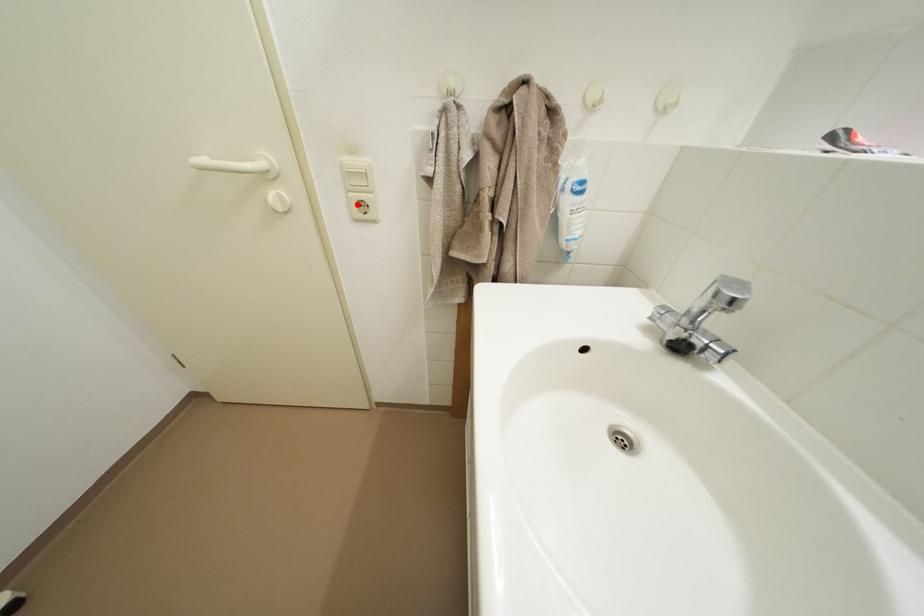
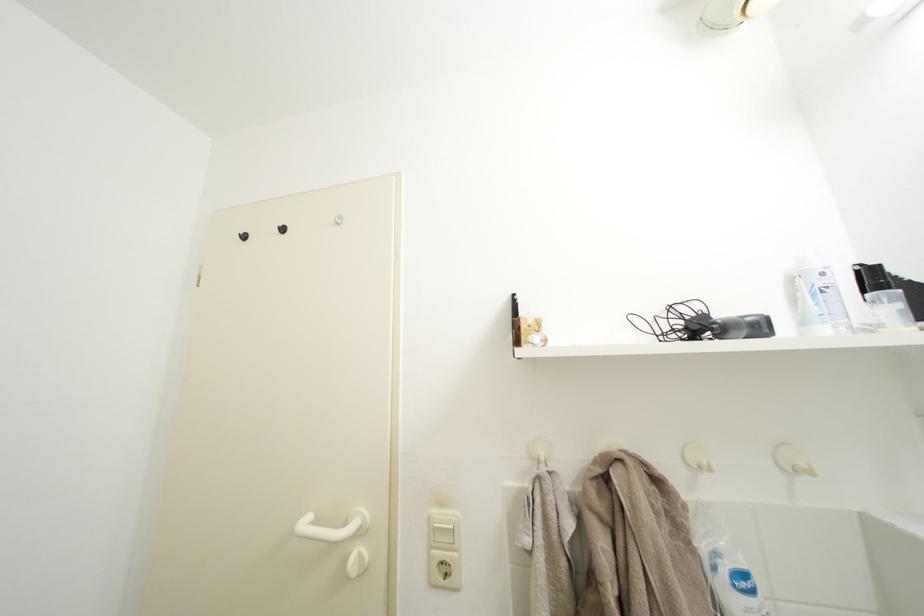
Question: I am providing you with two images of the same scene from different viewpoints. Given a red point in image1, look at the same physical point in image2. Is it:

Choices:
 (A) Closer to the viewpoint
 (B) Farther from the viewpoint

Answer: (B)